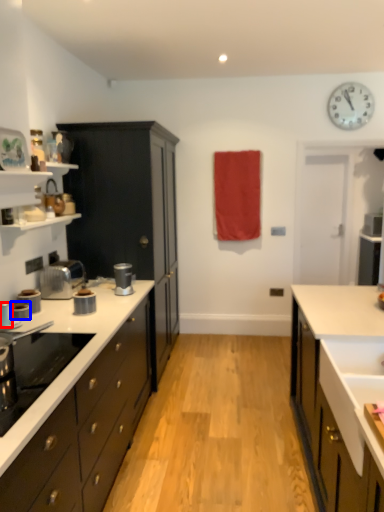
Question: Among these objects, which one is nearest to the camera, kitchen appliance (highlighted by a red box) or kitchen appliance (highlighted by a blue box)?

Choices:
 (A) kitchen appliance
 (B) kitchen appliance

Answer: (A)